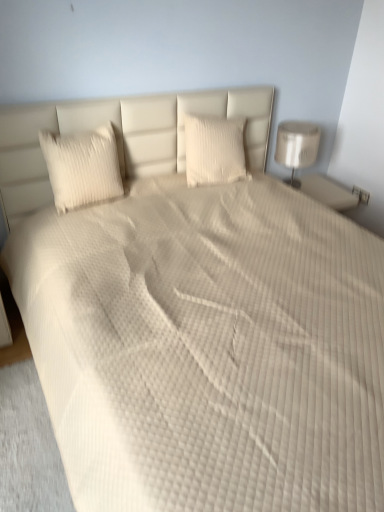
Question: From the image's perspective, would you say white textured pillow at left, acting as the first pillow starting from the left, is shown under white glossy lamp at right?

Choices:
 (A) no
 (B) yes

Answer: (B)

Question: Is white textured pillow at left, acting as the first pillow starting from the left, closer to the viewer compared to white glossy lamp at right?

Choices:
 (A) no
 (B) yes

Answer: (B)

Question: Is white textured pillow at left, marked as the 2th pillow in a right-to-left arrangement, outside of white glossy lamp at right?

Choices:
 (A) yes
 (B) no

Answer: (A)

Question: Considering the relative sizes of white textured pillow at left, marked as the 2th pillow in a right-to-left arrangement, and white glossy lamp at right in the image provided, is white textured pillow at left, marked as the 2th pillow in a right-to-left arrangement, bigger than white glossy lamp at right?

Choices:
 (A) yes
 (B) no

Answer: (B)

Question: Is white textured pillow at left, marked as the 2th pillow in a right-to-left arrangement, aimed at white glossy lamp at right?

Choices:
 (A) no
 (B) yes

Answer: (A)

Question: Is white textured pillow at left, acting as the first pillow starting from the left, taller or shorter than white glossy lamp at right?

Choices:
 (A) tall
 (B) short

Answer: (B)

Question: Considering the relative positions of white textured pillow at left, marked as the 2th pillow in a right-to-left arrangement, and white glossy lamp at right in the image provided, is white textured pillow at left, marked as the 2th pillow in a right-to-left arrangement, to the left or to the right of white glossy lamp at right?

Choices:
 (A) left
 (B) right

Answer: (A)

Question: Would you say white textured pillow at left, marked as the 2th pillow in a right-to-left arrangement, is inside or outside white glossy lamp at right?

Choices:
 (A) inside
 (B) outside

Answer: (B)

Question: Relative to white glossy lamp at right, is white textured pillow at left, marked as the 2th pillow in a right-to-left arrangement, in front or behind?

Choices:
 (A) behind
 (B) front

Answer: (B)

Question: Considering the positions of white textured pillow at center, arranged as the first pillow when viewed from the right, and white textured pillow at left, marked as the 2th pillow in a right-to-left arrangement, in the image, is white textured pillow at center, arranged as the first pillow when viewed from the right, taller or shorter than white textured pillow at left, marked as the 2th pillow in a right-to-left arrangement,?

Choices:
 (A) tall
 (B) short

Answer: (B)

Question: Considering the positions of white textured pillow at center, which ranks as the 2th pillow in left-to-right order, and white textured pillow at left, marked as the 2th pillow in a right-to-left arrangement, in the image, is white textured pillow at center, which ranks as the 2th pillow in left-to-right order, wider or thinner than white textured pillow at left, marked as the 2th pillow in a right-to-left arrangement,?

Choices:
 (A) thin
 (B) wide

Answer: (A)

Question: Does point (220, 141) appear closer or farther from the camera than point (97, 184)?

Choices:
 (A) closer
 (B) farther

Answer: (B)

Question: Is white textured pillow at center, arranged as the first pillow when viewed from the right, in front of or behind white textured pillow at left, marked as the 2th pillow in a right-to-left arrangement, in the image?

Choices:
 (A) behind
 (B) front

Answer: (A)

Question: From a real-world perspective, relative to white glossy lamp at right, is white textured pillow at center, arranged as the first pillow when viewed from the right, vertically above or below?

Choices:
 (A) below
 (B) above

Answer: (B)

Question: Is white textured pillow at center, arranged as the first pillow when viewed from the right, wider or thinner than white glossy lamp at right?

Choices:
 (A) thin
 (B) wide

Answer: (A)